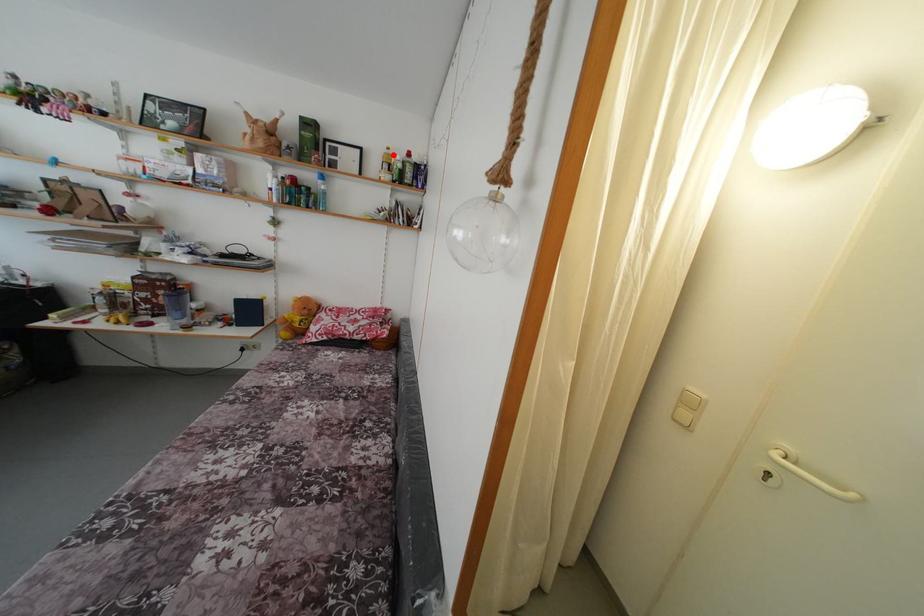
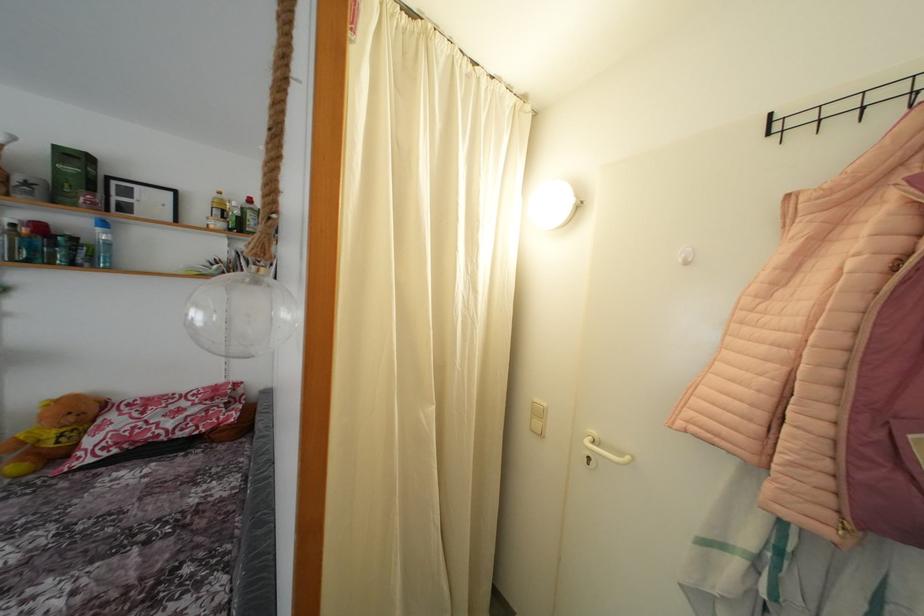
In the second image, find the point that corresponds to the highlighted location in the first image.

(225, 199)